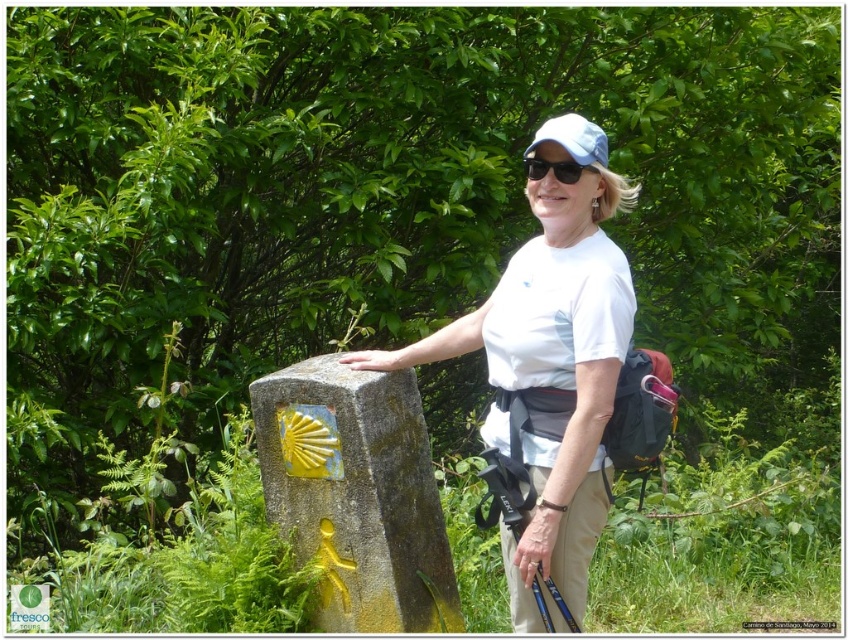
You are a photographer aiming to capture the hiker in the scene. The hiker is wearing a white cotton shirt at center and a light blue fabric baseball cap at center. Which clothing item is located to the left when viewed from the front of the hiker?

The white cotton shirt at center is positioned on the left side of the light blue fabric baseball cap at center, so the white cotton shirt at center is located to the left when viewed from the front of the hiker.

From the picture: You are a photographer aiming to capture the hiker and the stone marker in a single frame. The camera you are using has a limited field of view. Given that the hiker is wearing a white cotton shirt at center and the stone marker is located at point [551,372], can you determine if both subjects will fit within the frame?

The point [551,372] corresponds to the white cotton shirt at center, meaning the stone marker is positioned at the same location as the hiker. Therefore, both subjects are already overlapping and will fit within the frame.

You are a photographer trying to capture the hiker and the stone marker in a single shot. Your camera has a limited field of view. Which object, the light blue fabric baseball cap at center or the black matte sunglasses at center, would you need to adjust your camera angle to include if they are partially out of frame?

The light blue fabric baseball cap at center might be wider than the black matte sunglasses at center, so if both are partially out of frame, adjusting the camera angle to accommodate the wider object would be necessary.